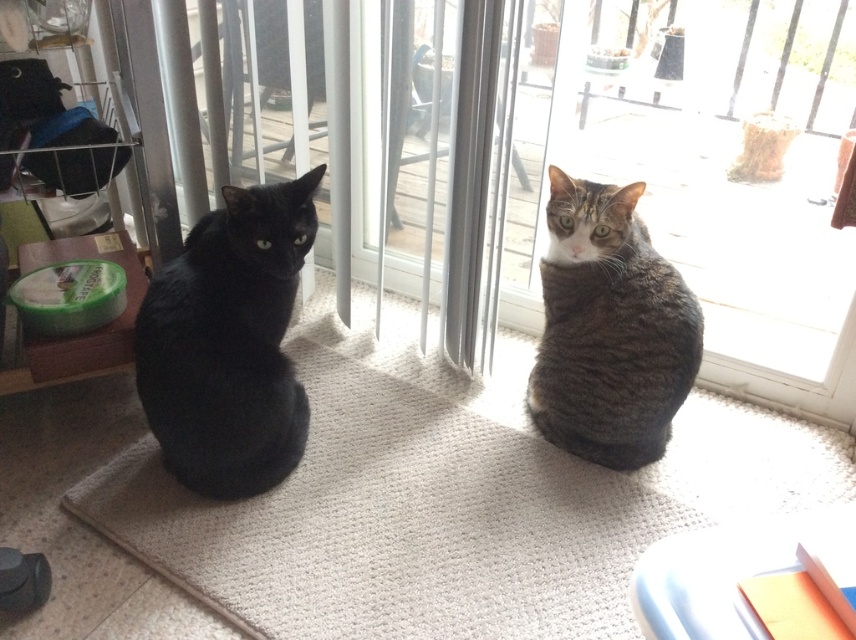
Is matte black cat at left closer to the viewer compared to tabby fur cat at center?

Yes.

Is matte black cat at left taller than tabby fur cat at center?

Yes, matte black cat at left is taller than tabby fur cat at center.

This screenshot has width=856, height=640. Describe the element at coordinates (229, 342) in the screenshot. I see `matte black cat at left` at that location.

The image size is (856, 640). In order to click on matte black cat at left in this screenshot , I will do `click(229, 342)`.